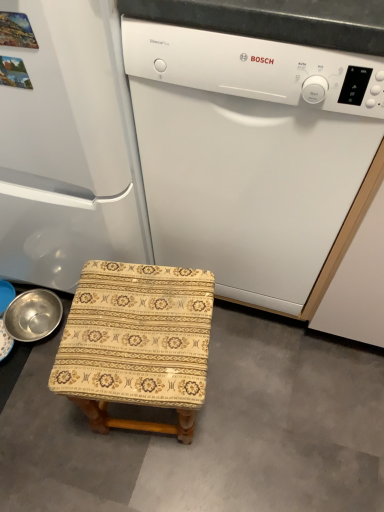
Where is `white matte refrigerator at left`? white matte refrigerator at left is located at coordinates (69, 149).

In order to click on patterned fabric stool at center in this screenshot , I will do `click(137, 343)`.

At what (x,y) coordinates should I click in order to perform the action: click on white matte dishwasher at center. Please return your answer as a coordinate pair (x, y). The height and width of the screenshot is (512, 384). Looking at the image, I should click on (254, 156).

Image resolution: width=384 pixels, height=512 pixels. Describe the element at coordinates (212, 431) in the screenshot. I see `beige fabric stool at lower left` at that location.

The width and height of the screenshot is (384, 512). Find the location of `white matte refrigerator at left`. white matte refrigerator at left is located at coordinates (69, 149).

Is point (23, 320) closer or farther from the camera than point (84, 327)?

Clearly, point (23, 320) is more distant from the camera than point (84, 327).

Looking at the image, does metallic silver basin at lower left seem bigger or smaller compared to patterned fabric stool at center?

Clearly, metallic silver basin at lower left is smaller in size than patterned fabric stool at center.

From the picture: Is metallic silver basin at lower left outside of patterned fabric stool at center?

Absolutely, metallic silver basin at lower left is external to patterned fabric stool at center.

From the image's perspective, is metallic silver basin at lower left beneath patterned fabric stool at center?

No.

Looking at this image, can you confirm if beige fabric stool at lower left is smaller than white matte refrigerator at left?

Yes.

How many degrees apart are the facing directions of beige fabric stool at lower left and white matte refrigerator at left?

The angular difference between beige fabric stool at lower left and white matte refrigerator at left is 91 degrees.

Is beige fabric stool at lower left looking in the opposite direction of white matte refrigerator at left?

No.

Is patterned fabric stool at center far from white matte refrigerator at left?

patterned fabric stool at center is near white matte refrigerator at left, not far away.

Can we say patterned fabric stool at center lies outside white matte refrigerator at left?

Absolutely, patterned fabric stool at center is external to white matte refrigerator at left.

Considering the positions of points (93, 357) and (78, 48), is point (93, 357) closer to camera compared to point (78, 48)?

No, it is behind (78, 48).

Is patterned fabric stool at center turned away from white matte refrigerator at left?

Yes, white matte refrigerator at left is at the back of patterned fabric stool at center.

You are a GUI agent. You are given a task and a screenshot of the screen. Output one action in this format:
    pyautogui.click(x=<x>, y=<y>)
    Task: Click on the home appliance directly beneath the white matte refrigerator at left (from a real-world perspective)
    This screenshot has width=384, height=512.
    Given the screenshot: What is the action you would take?
    pyautogui.click(x=254, y=156)

Would you say white matte refrigerator at left is inside or outside white matte dishwasher at center?

The correct answer is: outside.

Is white matte refrigerator at left facing towards white matte dishwasher at center?

No, white matte refrigerator at left is not turned towards white matte dishwasher at center.

Is patterned fabric stool at center behind beige fabric stool at lower left?

No, it is in front of beige fabric stool at lower left.

Which is behind, point (144, 368) or point (232, 485)?

The point (232, 485) is farther from the camera.

Looking at this image, between patterned fabric stool at center and beige fabric stool at lower left, which one has smaller width?

patterned fabric stool at center is thinner.

Considering the relative sizes of metallic silver basin at lower left and beige fabric stool at lower left in the image provided, is metallic silver basin at lower left bigger than beige fabric stool at lower left?

Actually, metallic silver basin at lower left might be smaller than beige fabric stool at lower left.

Which of these two, metallic silver basin at lower left or beige fabric stool at lower left, is wider?

Wider between the two is beige fabric stool at lower left.

You are a GUI agent. You are given a task and a screenshot of the screen. Output one action in this format:
    pyautogui.click(x=<x>, y=<y>)
    Task: Click on the concrete below the metallic silver basin at lower left (from the image's perspective)
    
    Given the screenshot: What is the action you would take?
    pyautogui.click(x=212, y=431)

From the image's perspective, relative to beige fabric stool at lower left, is metallic silver basin at lower left above or below?

Based on their image positions, metallic silver basin at lower left is located above beige fabric stool at lower left.

Is white matte refrigerator at left beside metallic silver basin at lower left?

No, white matte refrigerator at left is not making contact with metallic silver basin at lower left.

Considering the relative sizes of white matte refrigerator at left and metallic silver basin at lower left in the image provided, is white matte refrigerator at left taller than metallic silver basin at lower left?

Correct, white matte refrigerator at left is much taller as metallic silver basin at lower left.

Which of these two, white matte refrigerator at left or metallic silver basin at lower left, is wider?

white matte refrigerator at left.

At what (x,y) coordinates should I click in order to perform the action: click on furniture located on the right of metallic silver basin at lower left. Please return your answer as a coordinate pair (x, y). This screenshot has height=512, width=384. Looking at the image, I should click on (137, 343).

What are the coordinates of `refrigerator above the beige fabric stool at lower left (from the image's perspective)` in the screenshot? It's located at (69, 149).

From the image, which object appears to be nearer to metallic silver basin at lower left, white matte refrigerator at left or patterned fabric stool at center?

white matte refrigerator at left lies closer to metallic silver basin at lower left than the other object.

Estimate the real-world distances between objects in this image. Which object is further from white matte dishwasher at center, white matte refrigerator at left or beige fabric stool at lower left?

beige fabric stool at lower left is positioned further to the anchor white matte dishwasher at center.

Which object lies further to the anchor point white matte refrigerator at left, white matte dishwasher at center or metallic silver basin at lower left?

metallic silver basin at lower left.

Looking at the image, which one is located closer to white matte dishwasher at center, beige fabric stool at lower left or patterned fabric stool at center?

Based on the image, patterned fabric stool at center appears to be nearer to white matte dishwasher at center.

Based on their spatial positions, is patterned fabric stool at center or white matte dishwasher at center closer to beige fabric stool at lower left?

patterned fabric stool at center.

Estimate the real-world distances between objects in this image. Which object is further from white matte refrigerator at left, white matte dishwasher at center or patterned fabric stool at center?

The object further to white matte refrigerator at left is patterned fabric stool at center.

Based on their spatial positions, is patterned fabric stool at center or metallic silver basin at lower left further from white matte refrigerator at left?

metallic silver basin at lower left.

Looking at the image, which one is located closer to patterned fabric stool at center, white matte dishwasher at center or metallic silver basin at lower left?

white matte dishwasher at center is closer to patterned fabric stool at center.

Locate an element on the screen. This screenshot has width=384, height=512. home appliance between white matte refrigerator at left and patterned fabric stool at center in the up-down direction is located at coordinates (254, 156).

What are the coordinates of `furniture between white matte refrigerator at left and beige fabric stool at lower left in the up-down direction` in the screenshot? It's located at click(x=137, y=343).

Where is `furniture between white matte refrigerator at left and metallic silver basin at lower left along the z-axis`? furniture between white matte refrigerator at left and metallic silver basin at lower left along the z-axis is located at coordinates (137, 343).

Find the location of a particular element. home appliance between white matte refrigerator at left and beige fabric stool at lower left in the up-down direction is located at coordinates (254, 156).